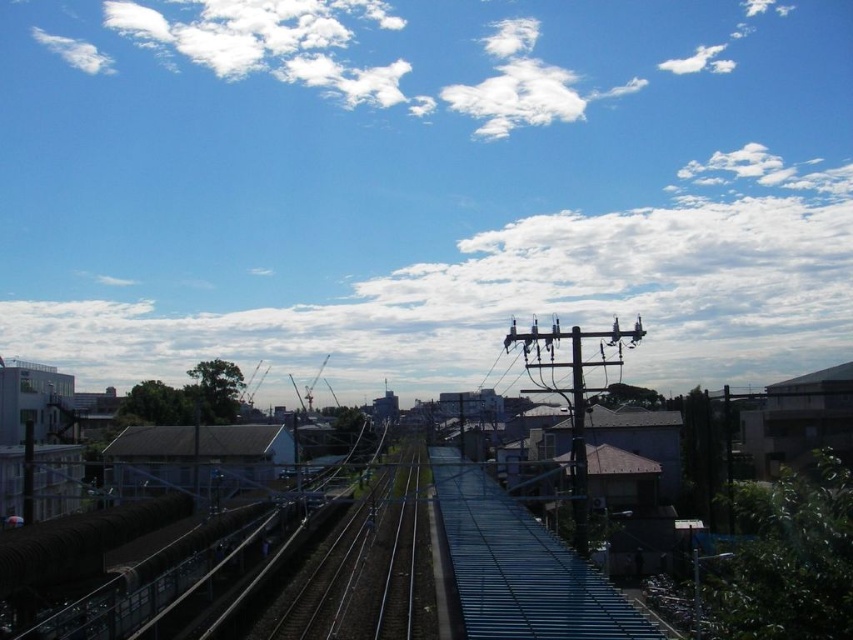
Which is below, metallic blue train track at center or white fluffy cloud at upper left?

metallic blue train track at center

Is metallic blue train track at center positioned in front of white fluffy cloud at upper left?

Yes.

This screenshot has height=640, width=853. I want to click on metallic blue train track at center, so click(364, 570).

This screenshot has width=853, height=640. I want to click on metallic blue train track at center, so click(364, 570).

Does metallic blue train track at center appear under white fluffy cloud at upper center?

Yes.

Measure the distance between point (293, 636) and camera.

The distance of point (293, 636) from camera is 24.13 meters.

Where is `metallic blue train track at center`? The height and width of the screenshot is (640, 853). metallic blue train track at center is located at coordinates (364, 570).

Where is `metallic blue train track at center`? This screenshot has width=853, height=640. metallic blue train track at center is located at coordinates (364, 570).

Does metallic gray power line at center have a greater height compared to white fluffy cloud at upper left?

No, metallic gray power line at center is not taller than white fluffy cloud at upper left.

Is metallic gray power line at center wider than white fluffy cloud at upper left?

No.

Image resolution: width=853 pixels, height=640 pixels. I want to click on metallic gray power line at center, so click(573, 396).